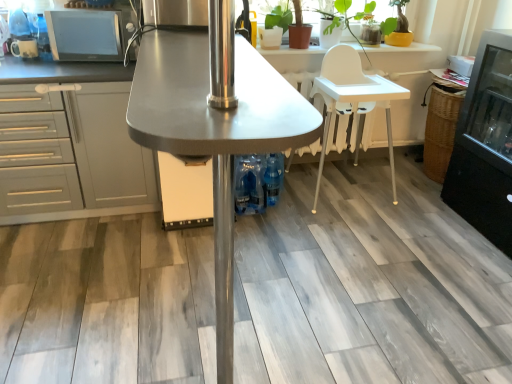
Question: Visually, is metallic gray table at center, arranged as the 1th table when viewed from the left, positioned to the left or to the right of gray matte cabinet at left?

Choices:
 (A) left
 (B) right

Answer: (B)

Question: Relative to gray matte cabinet at left, is metallic gray table at center, positioned as the 2th table in right-to-left order, in front or behind?

Choices:
 (A) front
 (B) behind

Answer: (A)

Question: Estimate the real-world distances between objects in this image. Which object is closer to the blue plastic bottles at center?

Choices:
 (A) gray matte cabinet at left
 (B) white plastic chair at center
 (C) metallic gray table at center, positioned as the 2th table in right-to-left order
 (D) matte brown pot at upper right
 (E) matte black microwave at upper left, which is counted as the first appliance, starting from the right

Answer: (B)

Question: Which is nearer to the white plastic chair at center?

Choices:
 (A) gray matte cabinet at left
 (B) matte black microwave at upper left, which is counted as the first appliance, starting from the right
 (C) matte brown pot at upper right
 (D) white plastic high chair at center, positioned as the first table in back-to-front order
 (E) matte white mug at upper left, arranged as the first appliance when viewed from the left

Answer: (D)